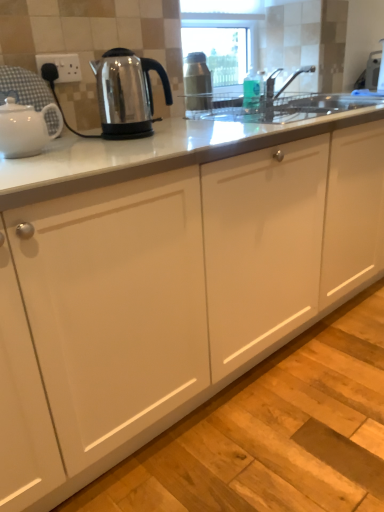
Locate an element on the screen. This screenshot has height=512, width=384. vacant area that lies in front of white glossy teapot at left, marked as the 2th kettle in a right-to-left arrangement is located at coordinates (33, 165).